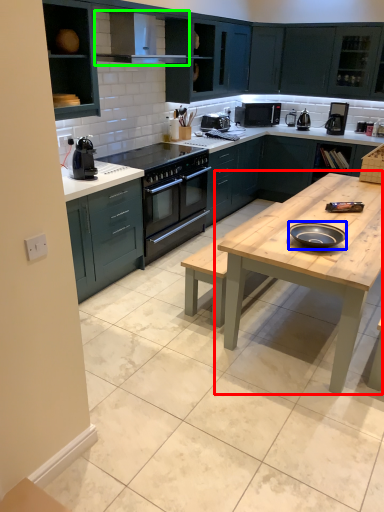
Question: Which is nearer to the table (highlighted by a red box)? pizza pan (highlighted by a blue box) or exhaust hood (highlighted by a green box).

Choices:
 (A) pizza pan
 (B) exhaust hood

Answer: (A)